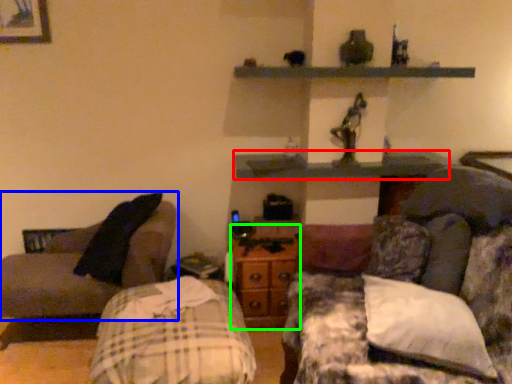
Question: Considering the real-world distances, which object is closest to shelf (highlighted by a red box)? studio couch (highlighted by a blue box) or dresser (highlighted by a green box).

Choices:
 (A) studio couch
 (B) dresser

Answer: (B)